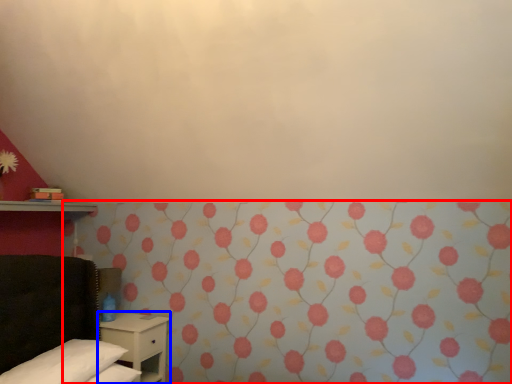
Question: Which of the following is the closest to the observer, curtain (highlighted by a red box) or nightstand (highlighted by a blue box)?

Choices:
 (A) curtain
 (B) nightstand

Answer: (A)